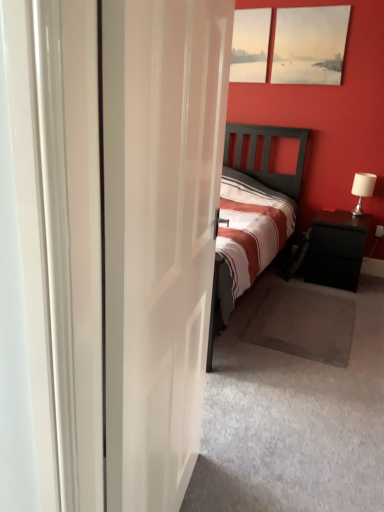
What do you see at coordinates (250, 45) in the screenshot? I see `matte wooden picture frame at upper center, the 1th picture frame from the left` at bounding box center [250, 45].

In order to click on matte canvas painting at upper right, which appears as the second picture frame when viewed from the left in this screenshot , I will do `click(310, 45)`.

At what (x,y) coordinates should I click in order to perform the action: click on white glossy door at center. Please return your answer as a coordinate pair (x, y). Looking at the image, I should click on (159, 234).

Where is `black matte nightstand at right`? The height and width of the screenshot is (512, 384). black matte nightstand at right is located at coordinates (336, 249).

Is black matte nightstand at right taller than white fabric lampshade at right?

Yes.

From the image's perspective, is black matte nightstand at right below white fabric lampshade at right?

Yes, from the image's perspective, black matte nightstand at right is below white fabric lampshade at right.

How much distance is there between black matte nightstand at right and white fabric lampshade at right?

black matte nightstand at right is 17.88 inches away from white fabric lampshade at right.

Considering the sizes of black matte nightstand at right and white fabric lampshade at right in the image, is black matte nightstand at right bigger or smaller than white fabric lampshade at right?

black matte nightstand at right is bigger than white fabric lampshade at right.

From the image's perspective, which one is positioned lower, white glossy door at center or black matte nightstand at right?

white glossy door at center, from the image's perspective.

From their relative heights in the image, would you say white glossy door at center is taller or shorter than black matte nightstand at right?

In the image, white glossy door at center appears to be taller than black matte nightstand at right.

Based on the photo, who is more distant, white glossy door at center or black matte nightstand at right?

black matte nightstand at right is behind.

Which is closer, (363, 186) or (328, 270)?

Point (363, 186) is positioned farther from the camera compared to point (328, 270).

Locate an element on the screen. lamp on the right of black matte nightstand at right is located at coordinates (362, 189).

Considering the relative positions of white fabric lampshade at right and black matte nightstand at right in the image provided, is white fabric lampshade at right to the left of black matte nightstand at right from the viewer's perspective?

No.

Is white fabric lampshade at right located outside black matte nightstand at right?

Yes, white fabric lampshade at right is outside of black matte nightstand at right.

Is matte canvas painting at upper right, which appears as the second picture frame when viewed from the left, located within matte wooden picture frame at upper center, the 1th picture frame from the left?

No.

Who is shorter, matte wooden picture frame at upper center, the 1th picture frame from the left, or matte canvas painting at upper right, the 1th picture frame positioned from the right?

matte wooden picture frame at upper center, the 1th picture frame from the left.

Is point (237, 26) closer to camera compared to point (340, 71)?

No, it is behind (340, 71).

From the image's perspective, is matte wooden picture frame at upper center, the 1th picture frame from the left, above matte canvas painting at upper right, which appears as the second picture frame when viewed from the left?

Correct, matte wooden picture frame at upper center, the 1th picture frame from the left, appears higher than matte canvas painting at upper right, which appears as the second picture frame when viewed from the left, in the image.

Does matte canvas painting at upper right, which appears as the second picture frame when viewed from the left, turn towards black matte nightstand at right?

No.

Consider the image. Is matte canvas painting at upper right, which appears as the second picture frame when viewed from the left, not near black matte nightstand at right?

matte canvas painting at upper right, which appears as the second picture frame when viewed from the left, is far away from black matte nightstand at right.

Would you say matte canvas painting at upper right, the 1th picture frame positioned from the right, is inside or outside black matte nightstand at right?

matte canvas painting at upper right, the 1th picture frame positioned from the right, is not inside black matte nightstand at right, it's outside.

From a real-world perspective, starting from the black matte nightstand at right, which picture frame is the 1st one vertically above it? Please provide its 2D coordinates.

[(310, 45)]

Between matte wooden picture frame at upper center, which ranks as the second picture frame in right-to-left order, and white glossy door at center, which one has less height?

With less height is matte wooden picture frame at upper center, which ranks as the second picture frame in right-to-left order.

Considering the relative sizes of matte wooden picture frame at upper center, which ranks as the second picture frame in right-to-left order, and white glossy door at center in the image provided, is matte wooden picture frame at upper center, which ranks as the second picture frame in right-to-left order, thinner than white glossy door at center?

Indeed, matte wooden picture frame at upper center, which ranks as the second picture frame in right-to-left order, has a lesser width compared to white glossy door at center.

Considering the sizes of objects matte wooden picture frame at upper center, which ranks as the second picture frame in right-to-left order, and white glossy door at center in the image provided, who is bigger, matte wooden picture frame at upper center, which ranks as the second picture frame in right-to-left order, or white glossy door at center?

white glossy door at center.

From the image's perspective, who appears lower, white glossy door at center or matte wooden picture frame at upper center, which ranks as the second picture frame in right-to-left order?

white glossy door at center, from the image's perspective.

Is white glossy door at center wider than matte wooden picture frame at upper center, the 1th picture frame from the left?

Indeed, white glossy door at center has a greater width compared to matte wooden picture frame at upper center, the 1th picture frame from the left.

Is white glossy door at center oriented towards matte wooden picture frame at upper center, the 1th picture frame from the left?

No, white glossy door at center is not facing towards matte wooden picture frame at upper center, the 1th picture frame from the left.

You are a GUI agent. You are given a task and a screenshot of the screen. Output one action in this format:
    pyautogui.click(x=<x>, y=<y>)
    Task: Click on the 2nd picture frame above the white glossy door at center (from a real-world perspective)
    The image size is (384, 512).
    Given the screenshot: What is the action you would take?
    pyautogui.click(x=250, y=45)

I want to click on lamp on the right of black matte nightstand at right, so click(362, 189).

Image resolution: width=384 pixels, height=512 pixels. I want to click on door above the black matte nightstand at right (from a real-world perspective), so click(159, 234).

Which object lies nearer to the anchor point white glossy door at center, black matte nightstand at right or matte wooden picture frame at upper center, the 1th picture frame from the left?

Among the two, black matte nightstand at right is located nearer to white glossy door at center.

When comparing their distances from black matte nightstand at right, does matte canvas painting at upper right, the 1th picture frame positioned from the right, or white glossy door at center seem further?

Based on the image, white glossy door at center appears to be further to black matte nightstand at right.

Looking at the image, which one is located closer to matte wooden picture frame at upper center, which ranks as the second picture frame in right-to-left order, black matte nightstand at right or matte canvas painting at upper right, which appears as the second picture frame when viewed from the left?

Based on the image, matte canvas painting at upper right, which appears as the second picture frame when viewed from the left, appears to be nearer to matte wooden picture frame at upper center, which ranks as the second picture frame in right-to-left order.

Which object lies further to the anchor point matte wooden picture frame at upper center, which ranks as the second picture frame in right-to-left order, matte canvas painting at upper right, which appears as the second picture frame when viewed from the left, or white glossy door at center?

Among the two, white glossy door at center is located further to matte wooden picture frame at upper center, which ranks as the second picture frame in right-to-left order.

Looking at the image, which one is located closer to matte wooden picture frame at upper center, which ranks as the second picture frame in right-to-left order, matte canvas painting at upper right, which appears as the second picture frame when viewed from the left, or white fabric lampshade at right?

matte canvas painting at upper right, which appears as the second picture frame when viewed from the left.

Considering their positions, is black matte nightstand at right positioned further to matte wooden picture frame at upper center, which ranks as the second picture frame in right-to-left order, than white glossy door at center?

Among the two, white glossy door at center is located further to matte wooden picture frame at upper center, which ranks as the second picture frame in right-to-left order.

Which object lies nearer to the anchor point matte canvas painting at upper right, the 1th picture frame positioned from the right, white fabric lampshade at right or white glossy door at center?

white fabric lampshade at right is closer to matte canvas painting at upper right, the 1th picture frame positioned from the right.

From the image, which object appears to be farther from black matte nightstand at right, matte wooden picture frame at upper center, which ranks as the second picture frame in right-to-left order, or matte canvas painting at upper right, the 1th picture frame positioned from the right?

matte wooden picture frame at upper center, which ranks as the second picture frame in right-to-left order.

I want to click on nightstand positioned between white glossy door at center and white fabric lampshade at right from near to far, so click(x=336, y=249).

Identify the location of picture frame between matte wooden picture frame at upper center, the 1th picture frame from the left, and white fabric lampshade at right, in the vertical direction. (310, 45).

Find the location of a particular element. This screenshot has width=384, height=512. lamp between matte wooden picture frame at upper center, which ranks as the second picture frame in right-to-left order, and black matte nightstand at right, in the vertical direction is located at coordinates (362, 189).

Where is `picture frame between white glossy door at center and matte wooden picture frame at upper center, which ranks as the second picture frame in right-to-left order, from front to back`? picture frame between white glossy door at center and matte wooden picture frame at upper center, which ranks as the second picture frame in right-to-left order, from front to back is located at coordinates (310, 45).